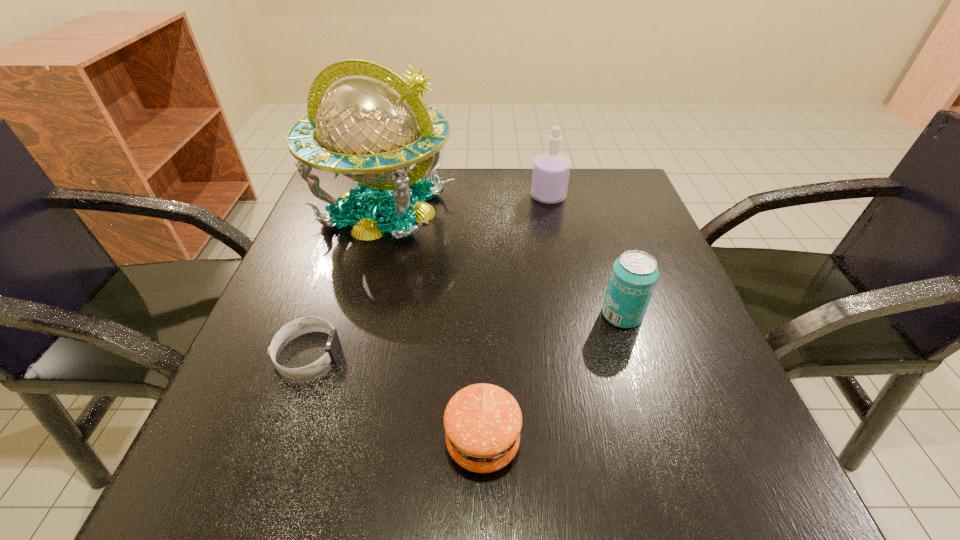
Locate an element on the screen. The image size is (960, 540). the tallest object is located at coordinates (372, 127).

Locate an element on the screen. the fourth shortest object is located at coordinates (551, 170).

At what (x,y) coordinates should I click in order to perform the action: click on the second object from right to left. Please return your answer as a coordinate pair (x, y). The width and height of the screenshot is (960, 540). Looking at the image, I should click on (551, 170).

Image resolution: width=960 pixels, height=540 pixels. Find the location of `beer can`. beer can is located at coordinates (634, 274).

The width and height of the screenshot is (960, 540). Find the location of `the third tallest object`. the third tallest object is located at coordinates coord(634,274).

Where is `the fourth tallest object`? The image size is (960, 540). the fourth tallest object is located at coordinates (482, 422).

You are a GUI agent. You are given a task and a screenshot of the screen. Output one action in this format:
    pyautogui.click(x=<x>, y=<y>)
    Task: Click on the patty
    
    Given the screenshot: What is the action you would take?
    pyautogui.click(x=482, y=422)

The width and height of the screenshot is (960, 540). I want to click on the shortest object, so click(x=332, y=347).

This screenshot has width=960, height=540. Identify the location of free space located 0.340m on the front of the globe. (329, 404).

This screenshot has width=960, height=540. What are the coordinates of `free space located 0.250m on the left of the second tallest object` in the screenshot? It's located at (425, 197).